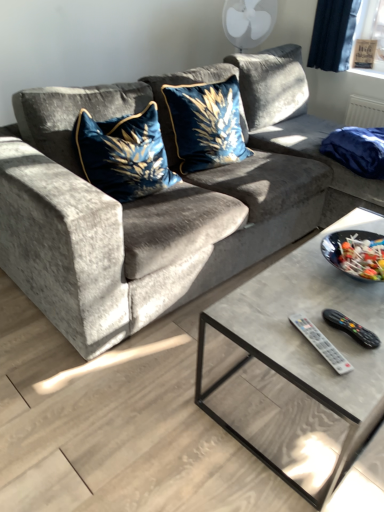
Question: From the image's perspective, does velvet blue pillow at center, the first throw pillow from the left, appear lower than white plastic remote at lower right, the 2th remote viewed from the right?

Choices:
 (A) no
 (B) yes

Answer: (A)

Question: Does velvet blue pillow at center, which is the 2th throw pillow from right to left, appear on the right side of white plastic remote at lower right, arranged as the first remote when viewed from the left?

Choices:
 (A) yes
 (B) no

Answer: (B)

Question: Considering the relative sizes of velvet blue pillow at center, which is the 2th throw pillow from right to left, and white plastic remote at lower right, arranged as the first remote when viewed from the left, in the image provided, is velvet blue pillow at center, which is the 2th throw pillow from right to left, smaller than white plastic remote at lower right, arranged as the first remote when viewed from the left,?

Choices:
 (A) no
 (B) yes

Answer: (A)

Question: Does velvet blue pillow at center, the first throw pillow from the left, lie in front of white plastic remote at lower right, arranged as the first remote when viewed from the left?

Choices:
 (A) no
 (B) yes

Answer: (A)

Question: From a real-world perspective, is velvet blue pillow at center, the first throw pillow from the left, physically below white plastic remote at lower right, the 2th remote viewed from the right?

Choices:
 (A) yes
 (B) no

Answer: (B)

Question: Does velvet blue pillow at center, which is the 2th throw pillow from right to left, have a larger size compared to white plastic remote at lower right, arranged as the first remote when viewed from the left?

Choices:
 (A) yes
 (B) no

Answer: (A)

Question: Does velvet blue pillow at upper right have a smaller size compared to black plastic remote at lower right, which is counted as the first remote, starting from the right?

Choices:
 (A) no
 (B) yes

Answer: (A)

Question: Is black plastic remote at lower right, which is counted as the first remote, starting from the right, at the back of velvet blue pillow at upper right?

Choices:
 (A) no
 (B) yes

Answer: (A)

Question: Considering the relative sizes of velvet blue pillow at upper right and black plastic remote at lower right, which is counted as the first remote, starting from the right, in the image provided, is velvet blue pillow at upper right taller than black plastic remote at lower right, which is counted as the first remote, starting from the right,?

Choices:
 (A) yes
 (B) no

Answer: (A)

Question: Is the depth of velvet blue pillow at upper right less than that of black plastic remote at lower right, which is counted as the first remote, starting from the right?

Choices:
 (A) yes
 (B) no

Answer: (B)

Question: Could you tell me if velvet blue pillow at upper right is facing black plastic remote at lower right, which is counted as the first remote, starting from the right?

Choices:
 (A) yes
 (B) no

Answer: (B)

Question: From the image's perspective, is velvet blue pillow at upper right below black plastic remote at lower right, which is counted as the first remote, starting from the right?

Choices:
 (A) yes
 (B) no

Answer: (B)

Question: Is velvet blue pillow at upper right at the left side of velvet blue pillow at center, the first throw pillow from the left?

Choices:
 (A) no
 (B) yes

Answer: (A)